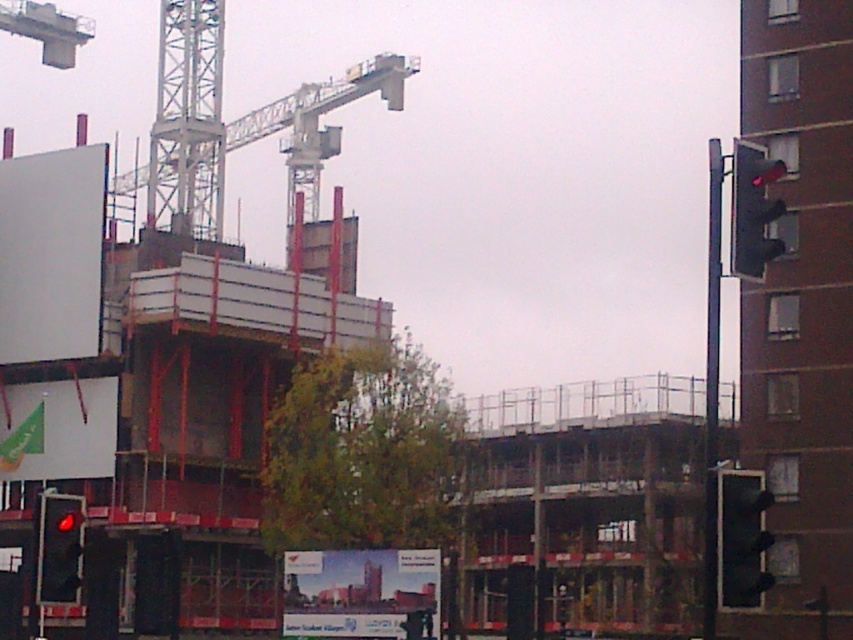
Question: Which point is closer to the camera taking this photo?

Choices:
 (A) (13, 477)
 (B) (728, 602)

Answer: (B)

Question: Which object is closer to the camera taking this photo?

Choices:
 (A) metallic gray crane at upper center
 (B) green fabric banner at lower left

Answer: (B)

Question: Is the position of matte glass billboard at center more distant than that of red glass traffic light at lower left?

Choices:
 (A) no
 (B) yes

Answer: (B)

Question: Can you confirm if metallic gray crane at upper center is positioned to the right of red matte traffic light at right?

Choices:
 (A) yes
 (B) no

Answer: (B)

Question: Which point is farther from the camera taking this photo?

Choices:
 (A) (24, 387)
 (B) (68, 316)
 (C) (393, 104)
 (D) (80, 556)

Answer: (C)

Question: Is black plastic traffic light at right closer to camera compared to red matte traffic light at right?

Choices:
 (A) yes
 (B) no

Answer: (A)